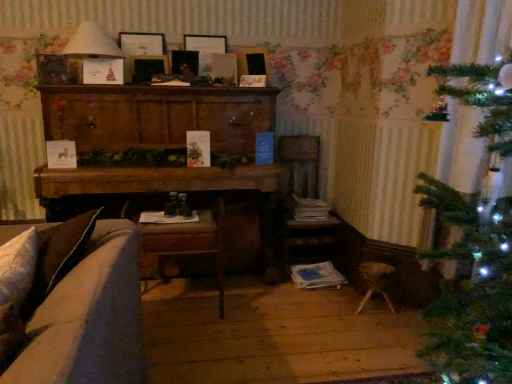
Where is `free space in front of wooden armchair at center`? The image size is (512, 384). free space in front of wooden armchair at center is located at coordinates (296, 298).